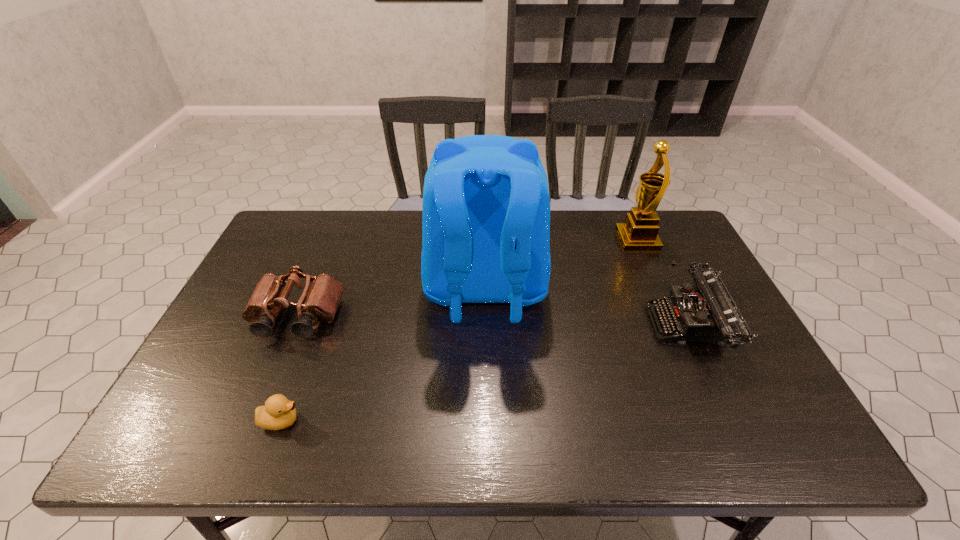
What are the coordinates of `vacant space situated on the front-facing side of the award` in the screenshot? It's located at (509, 240).

You are a GUI agent. You are given a task and a screenshot of the screen. Output one action in this format:
    pyautogui.click(x=<x>, y=<y>)
    Task: Click on the blank space located 0.110m on the keyboard of the typewriter
    The image size is (960, 540).
    Given the screenshot: What is the action you would take?
    pyautogui.click(x=610, y=326)

I want to click on vacant point located 0.270m on the keyboard of the typewriter, so click(x=549, y=326).

Locate an element on the screen. free space located on the keyboard of the typewriter is located at coordinates (564, 326).

Find the location of a particular element. vacant space positioned 0.120m through the eyepieces of the binoculars is located at coordinates (271, 382).

The height and width of the screenshot is (540, 960). What are the coordinates of `free space located 0.220m on the face of the nearest object` in the screenshot? It's located at (402, 421).

Identify the location of backpack present at the far edge. This screenshot has height=540, width=960. (486, 210).

I want to click on award at the far edge, so click(639, 233).

Identify the location of object present at the near edge. The height and width of the screenshot is (540, 960). (278, 413).

Find the location of `object that is at the left edge`. object that is at the left edge is located at coordinates (319, 302).